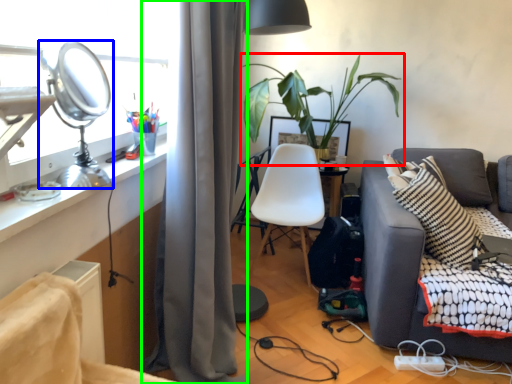
Question: Which object is positioned closest to houseplant (highlighted by a red box)? Select from table lamp (highlighted by a blue box) and curtain (highlighted by a green box).

Choices:
 (A) table lamp
 (B) curtain

Answer: (B)